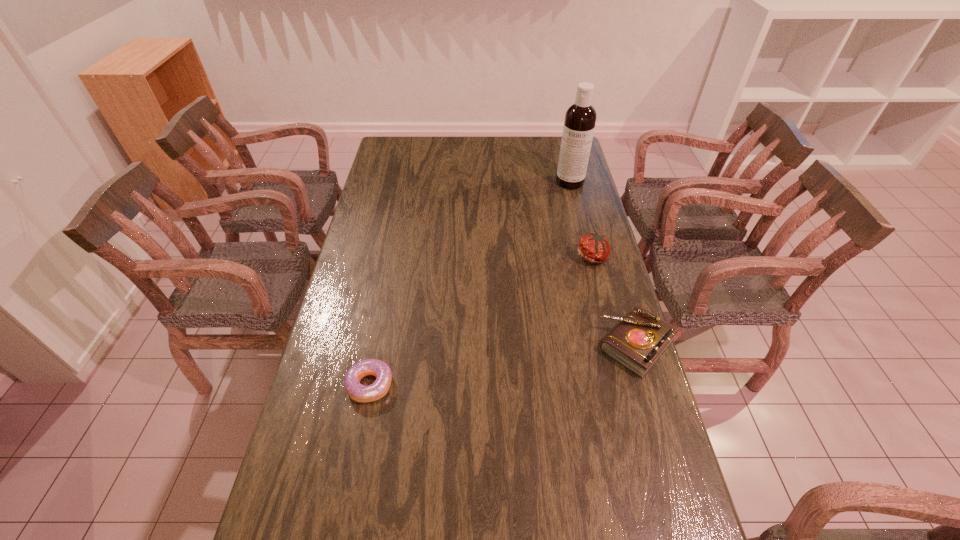
In order to click on free point that satisfies the following two spatial constraints: 1. on the back side of the third tallest object; 2. on the right side of the shortest object in this screenshot , I will do `click(377, 345)`.

Find the location of a particular element. The height and width of the screenshot is (540, 960). free location that satisfies the following two spatial constraints: 1. on the back side of the third tallest object; 2. on the left side of the shortest object is located at coordinates (377, 345).